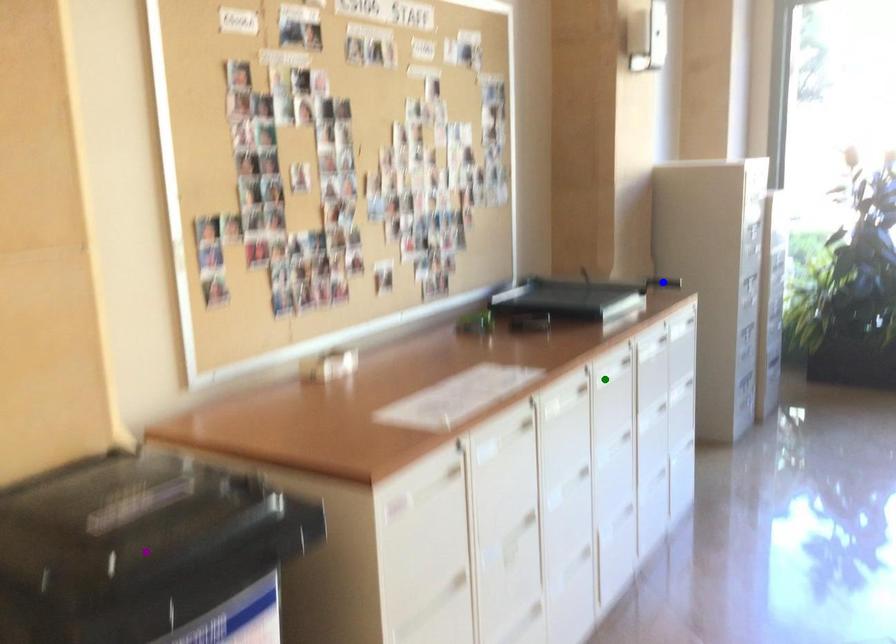
Order these from nearest to farthest:
green point, purple point, blue point

purple point, green point, blue point